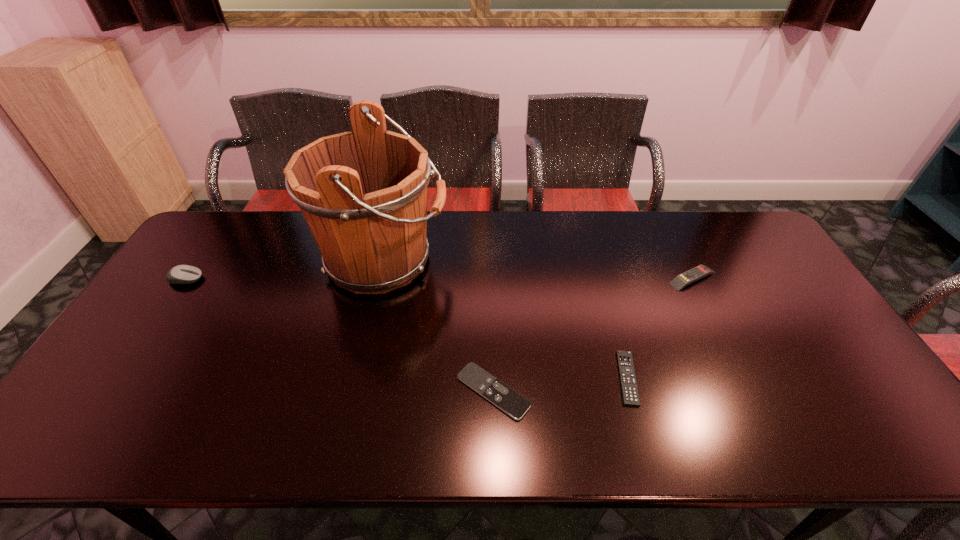
Find the location of a particular element. This screenshot has width=960, height=540. vacant area situated 0.350m on the left of the farthest remote control is located at coordinates (553, 278).

The width and height of the screenshot is (960, 540). What are the coordinates of `free region located on the right of the third object from right to left` in the screenshot? It's located at (632, 391).

Find the location of a particular element. This screenshot has width=960, height=540. free space located on the right of the fourth object from left to right is located at coordinates (694, 378).

Where is `object at the far edge`? The height and width of the screenshot is (540, 960). object at the far edge is located at coordinates (363, 193).

Where is `object at the near edge`? This screenshot has width=960, height=540. object at the near edge is located at coordinates (505, 398).

Image resolution: width=960 pixels, height=540 pixels. In order to click on object located in the left edge section of the desktop in this screenshot , I will do `click(182, 274)`.

Find the location of `free space at the far edge of the desktop`. free space at the far edge of the desktop is located at coordinates (620, 241).

This screenshot has width=960, height=540. What are the coordinates of `vacant space at the right edge of the desktop` in the screenshot? It's located at coord(777,284).

You are a GUI agent. You are given a task and a screenshot of the screen. Output one action in this format:
    pyautogui.click(x=<x>, y=<y>)
    Task: Click on the vacant space at the far left corner of the desktop
    
    Given the screenshot: What is the action you would take?
    pyautogui.click(x=252, y=225)

I want to click on vacant space at the near right corner of the desktop, so click(849, 429).